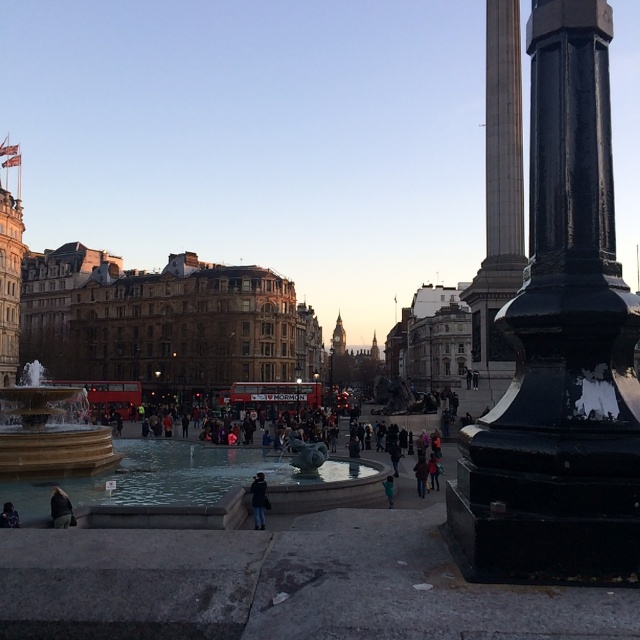
Is black polished column at center wider than dark blue jacket at lower left?

Indeed, black polished column at center has a greater width compared to dark blue jacket at lower left.

Is black polished column at center above dark blue jacket at lower left?

Indeed, black polished column at center is positioned over dark blue jacket at lower left.

Locate an element on the screen. This screenshot has width=640, height=640. black polished column at center is located at coordinates (561, 346).

Can you confirm if black polished column at center is thinner than dark blue jeans at center?

Incorrect, black polished column at center's width is not less than dark blue jeans at center's.

Is black polished column at center taller than dark blue jeans at center?

Yes, black polished column at center is taller than dark blue jeans at center.

Is point (577, 579) farther from camera compared to point (252, 488)?

No, it is not.

At what (x,y) coordinates should I click in order to perform the action: click on black polished column at center. Please return your answer as a coordinate pair (x, y). The height and width of the screenshot is (640, 640). Looking at the image, I should click on coord(561,346).

Is dark blue jeans at center closer to camera compared to dark gray fabric jacket at lower left?

No, dark blue jeans at center is behind dark gray fabric jacket at lower left.

Is dark blue jeans at center taller than dark gray fabric jacket at lower left?

Indeed, dark blue jeans at center has a greater height compared to dark gray fabric jacket at lower left.

The image size is (640, 640). In order to click on dark blue jeans at center in this screenshot , I will do `click(259, 499)`.